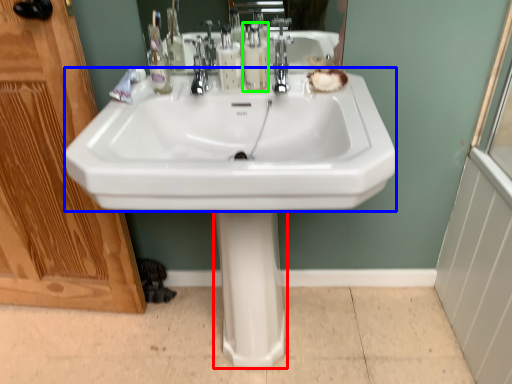
Question: Which object is positioned closest to bidet (highlighted by a red box)? Select from sink (highlighted by a blue box) and soap dispenser (highlighted by a green box).

Choices:
 (A) sink
 (B) soap dispenser

Answer: (A)